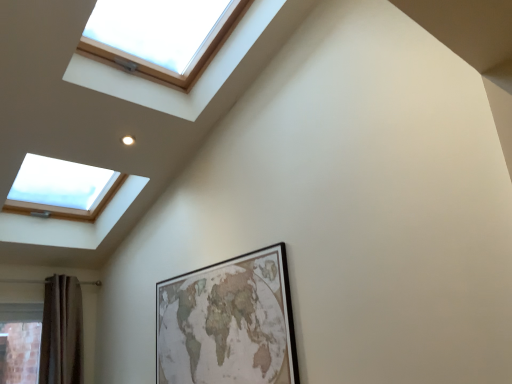
Question: Is wooden framed map at center located outside wooden frame skylight at upper left?

Choices:
 (A) yes
 (B) no

Answer: (A)

Question: Does wooden framed map at center have a greater height compared to wooden frame skylight at upper left?

Choices:
 (A) yes
 (B) no

Answer: (B)

Question: Can you confirm if wooden framed map at center is bigger than wooden frame skylight at upper left?

Choices:
 (A) yes
 (B) no

Answer: (B)

Question: Is wooden framed map at center at the right side of wooden frame skylight at upper left?

Choices:
 (A) no
 (B) yes

Answer: (B)

Question: From a real-world perspective, does wooden framed map at center sit lower than wooden frame skylight at upper left?

Choices:
 (A) no
 (B) yes

Answer: (B)

Question: In terms of size, does wooden frame skylight at upper left appear bigger or smaller than wooden framed map at center?

Choices:
 (A) small
 (B) big

Answer: (B)

Question: In terms of height, does wooden frame skylight at upper left look taller or shorter compared to wooden framed map at center?

Choices:
 (A) tall
 (B) short

Answer: (A)

Question: Is wooden frame skylight at upper left in front of or behind wooden framed map at center in the image?

Choices:
 (A) front
 (B) behind

Answer: (A)

Question: Is point (209, 46) closer or farther from the camera than point (200, 354)?

Choices:
 (A) closer
 (B) farther

Answer: (B)

Question: Based on their positions, is wooden framed map at center located to the left or right of brown textured curtain at lower left?

Choices:
 (A) right
 (B) left

Answer: (A)

Question: Does point (263, 271) appear closer or farther from the camera than point (53, 299)?

Choices:
 (A) closer
 (B) farther

Answer: (A)

Question: From the image's perspective, is wooden framed map at center positioned above or below brown textured curtain at lower left?

Choices:
 (A) above
 (B) below

Answer: (A)

Question: Is wooden framed map at center bigger or smaller than brown textured curtain at lower left?

Choices:
 (A) small
 (B) big

Answer: (A)

Question: Based on their sizes in the image, would you say brown textured curtain at lower left is bigger or smaller than wooden framed map at center?

Choices:
 (A) big
 (B) small

Answer: (A)

Question: Considering the positions of brown textured curtain at lower left and wooden framed map at center in the image, is brown textured curtain at lower left wider or thinner than wooden framed map at center?

Choices:
 (A) thin
 (B) wide

Answer: (B)